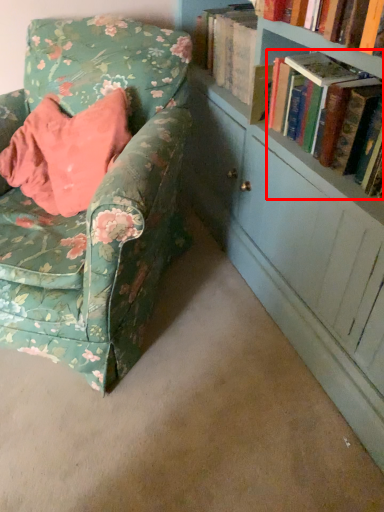
Question: Observing the image, what is the correct spatial positioning of book (annotated by the red box) in reference to chair?

Choices:
 (A) right
 (B) left

Answer: (A)